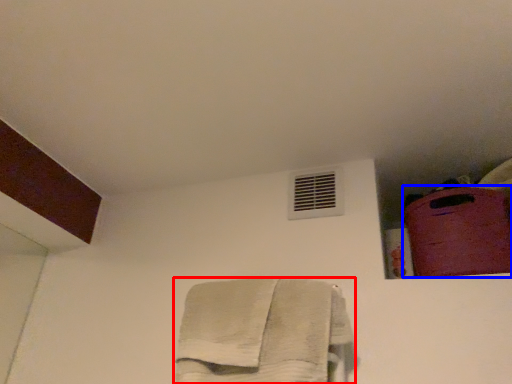
Question: Which object is closer to the camera taking this photo, towel (highlighted by a red box) or luggage (highlighted by a blue box)?

Choices:
 (A) towel
 (B) luggage

Answer: (A)